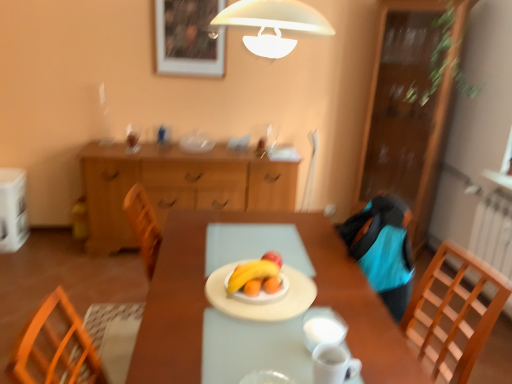
Locate an element on the screen. free space to the left of white glossy mug at lower center, the 3th tableware viewed from the back is located at coordinates (260, 361).